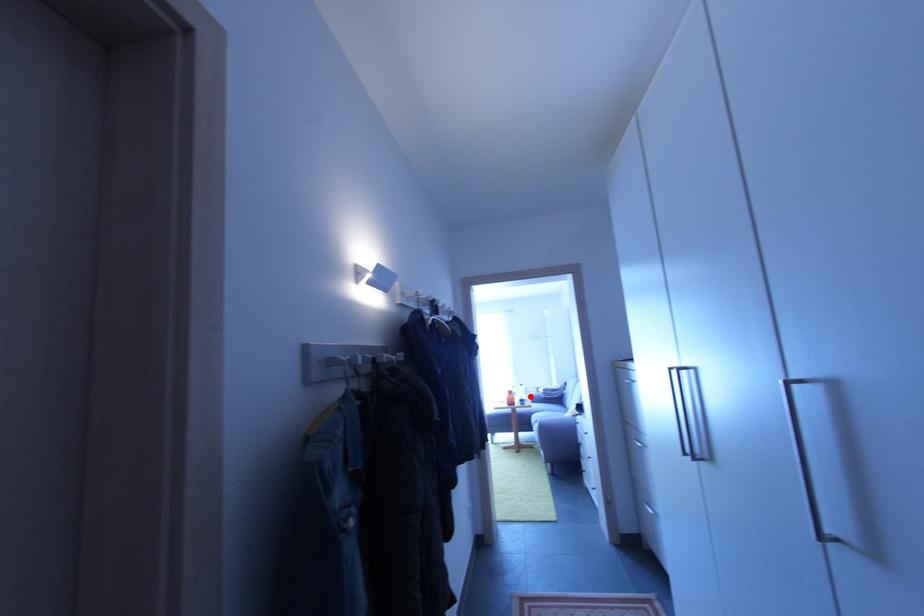
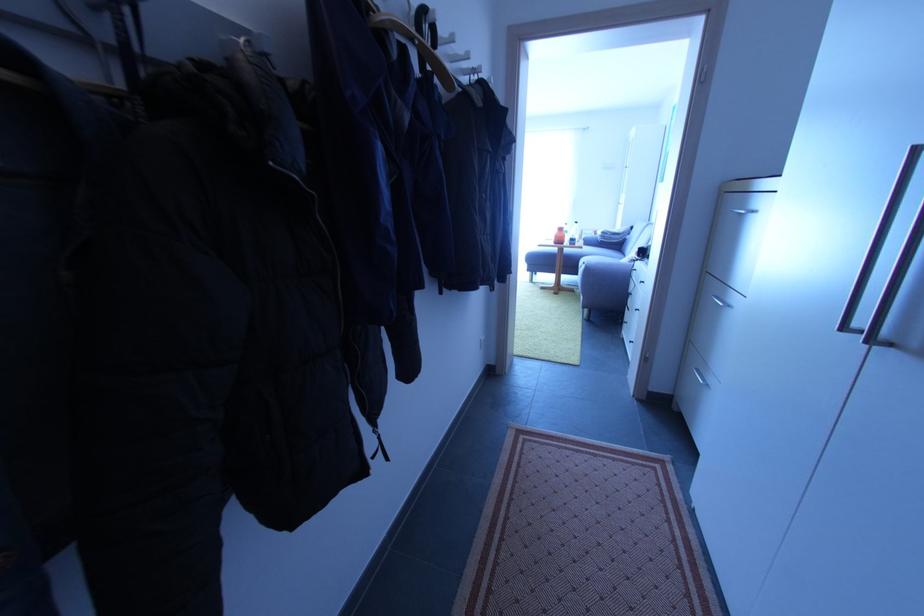
Question: A red point is marked in image1. In image2, is the corresponding 3D point closer to the camera or farther? Reply with the corresponding letter.

Choices:
 (A) The corresponding 3D point is closer.
 (B) The corresponding 3D point is farther.

Answer: (A)